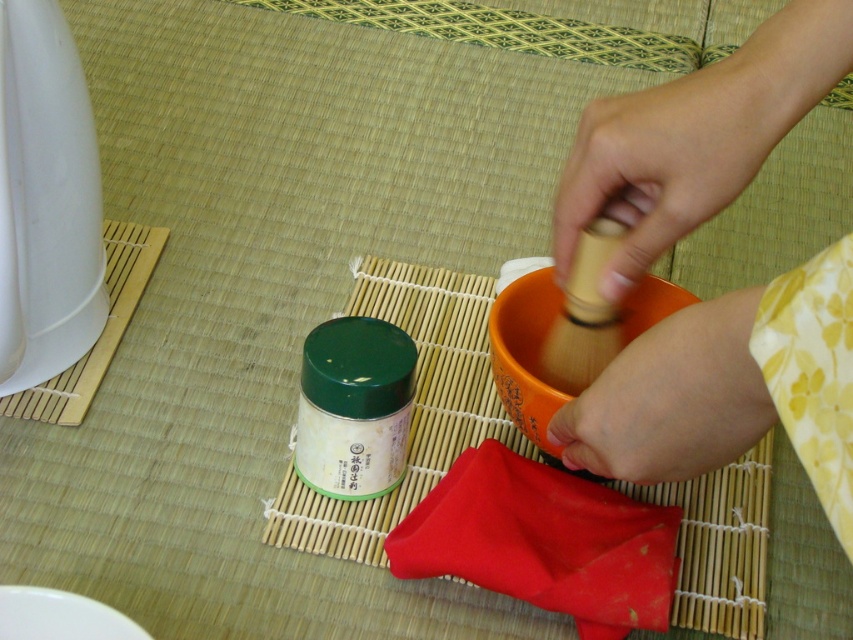
Measure the distance between point (769, 336) and camera.

Point (769, 336) is 12.86 inches from camera.

At what (x,y) coordinates should I click in order to perform the action: click on wooden rolling pin at upper right. Please return your answer as a coordinate pair (x, y). Image resolution: width=853 pixels, height=640 pixels. Looking at the image, I should click on (730, 387).

Does wooden rolling pin at upper center have a lesser height compared to wooden whisk at center?

In fact, wooden rolling pin at upper center may be taller than wooden whisk at center.

Is point (641, 244) positioned after point (653, 454)?

Yes, point (641, 244) is farther from viewer.

Which is in front, point (688, 202) or point (569, 442)?

Point (688, 202) is more forward.

This screenshot has width=853, height=640. Identify the location of wooden rolling pin at upper center. (664, 163).

Does point (606, 406) lie behind point (579, 173)?

No, (606, 406) is closer to viewer.

Between wooden rolling pin at upper right and wooden rolling pin at upper center, which one is positioned lower?

Positioned lower is wooden rolling pin at upper right.

Image resolution: width=853 pixels, height=640 pixels. What do you see at coordinates (730, 387) in the screenshot?
I see `wooden rolling pin at upper right` at bounding box center [730, 387].

You are a GUI agent. You are given a task and a screenshot of the screen. Output one action in this format:
    pyautogui.click(x=<x>, y=<y>)
    Task: Click on the wooden rolling pin at upper right
    The height and width of the screenshot is (640, 853).
    Given the screenshot: What is the action you would take?
    pyautogui.click(x=730, y=387)